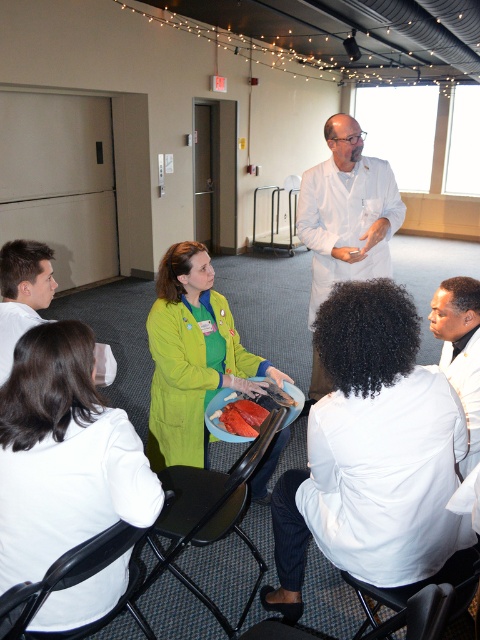
You are a photographer standing at the back of the room. You need to capture a clear photo of both the green matte jacket at center and the smooth white shirt at lower left. Which object should you focus on first to ensure both are in focus?

The green matte jacket at center is much taller than the smooth white shirt at lower left, so you should focus on the green matte jacket at center first to ensure both are in focus.

You are a student in the classroom and want to hand a note to the person wearing the green fabric coat at center without touching the smooth orange plate at center. Which direction should you move towards?

The green fabric coat at center is to the right of the smooth orange plate at center, so you should move towards the right side of the smooth orange plate at center to reach the green fabric coat at center without touching the plate.